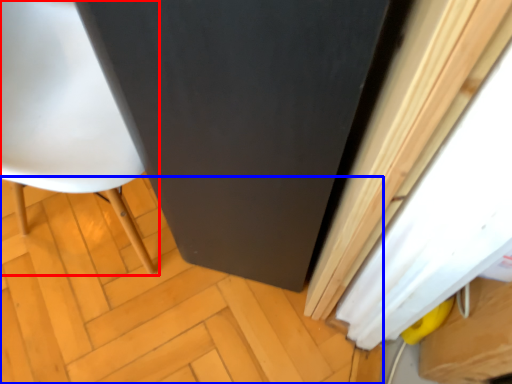
Question: Which of the following is the closest to the observer, chair (highlighted by a red box) or plywood (highlighted by a blue box)?

Choices:
 (A) chair
 (B) plywood

Answer: (A)